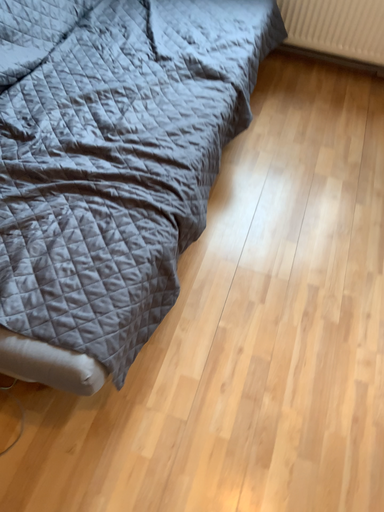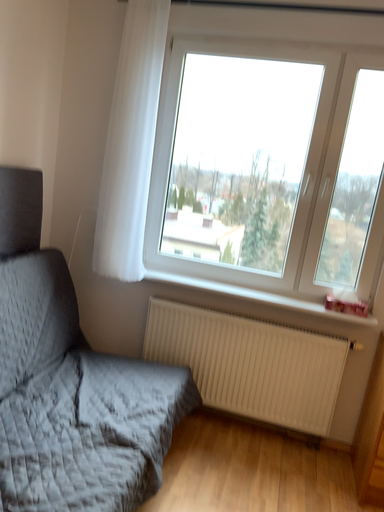
Question: How did the camera likely rotate when shooting the video?

Choices:
 (A) rotated upward
 (B) rotated downward

Answer: (A)